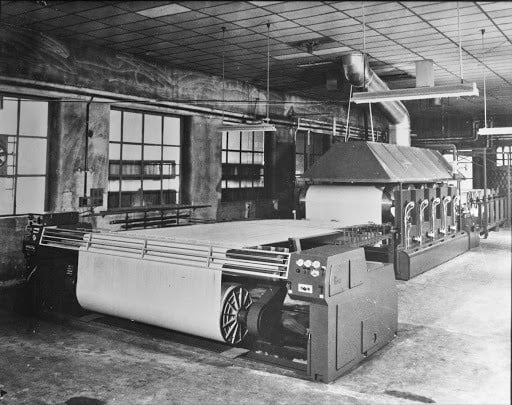
Locate an element on the screen. ceiling bolt is located at coordinates (221, 26), (267, 27), (482, 30).